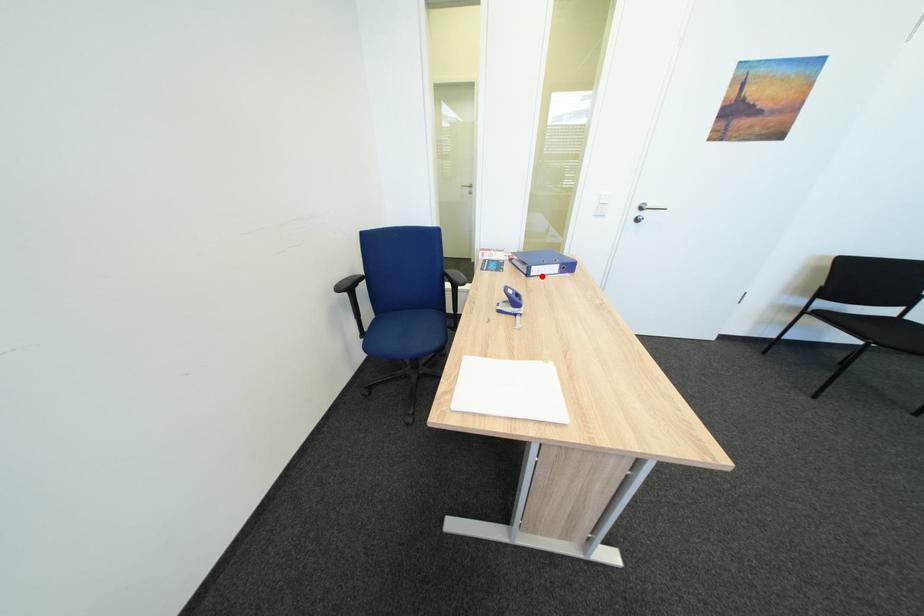
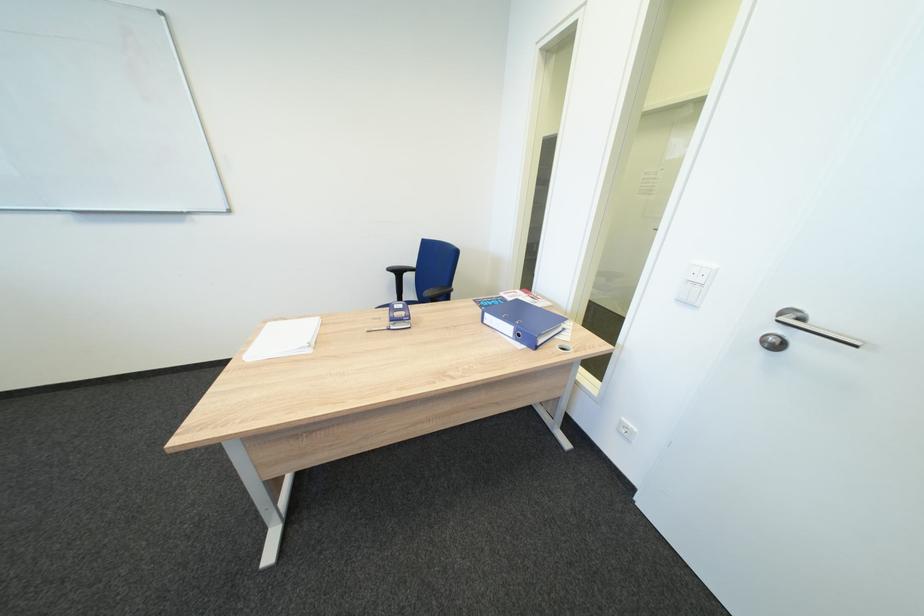
In the second image, find the point that corresponds to the highlighted location in the first image.

(495, 323)